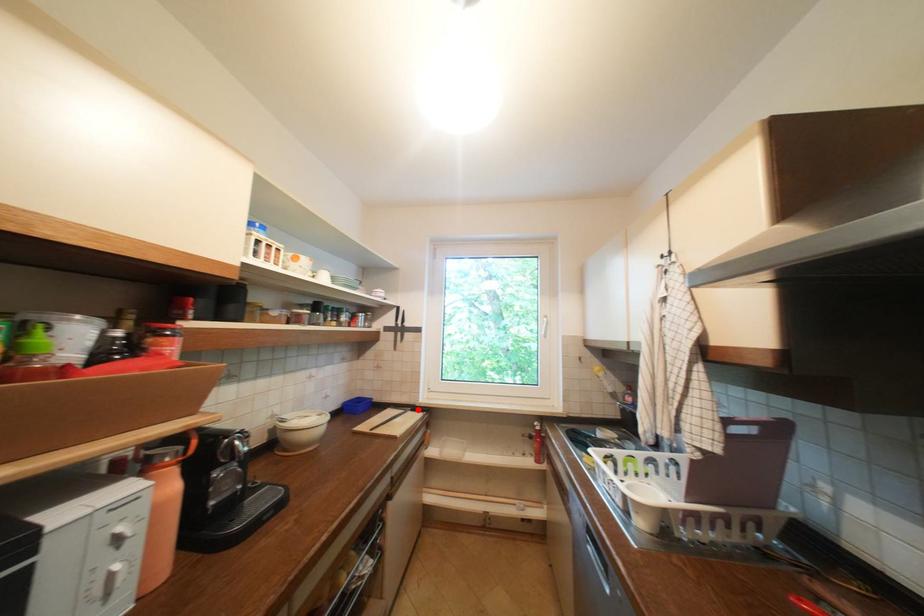
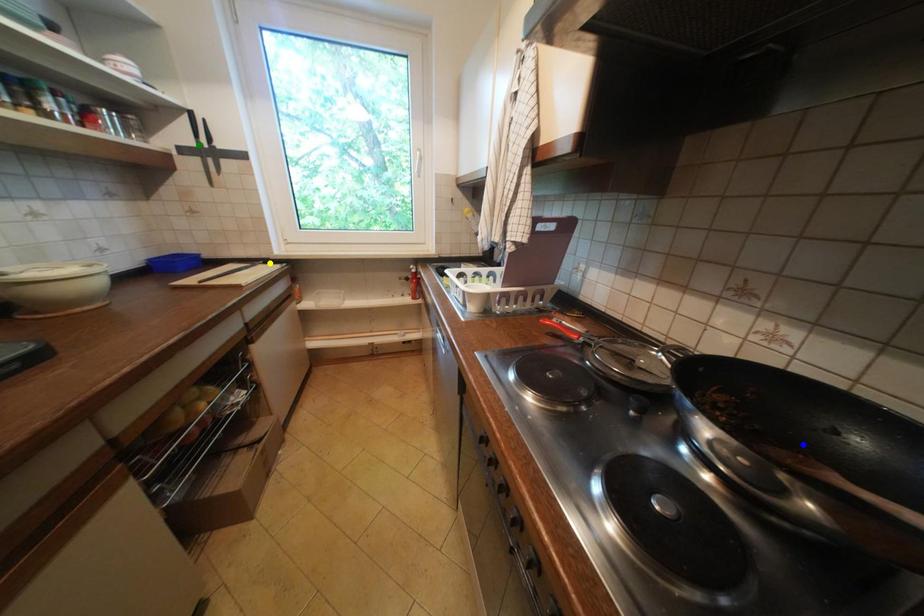
Question: I am providing you with two images of the same scene from different viewpoints. A red point is marked on the first image. You are given multiple points on the second image. Which spot in image 2 lines up with the point in image 1?

Choices:
 (A) green point
 (B) yellow point
 (C) blue point

Answer: (B)